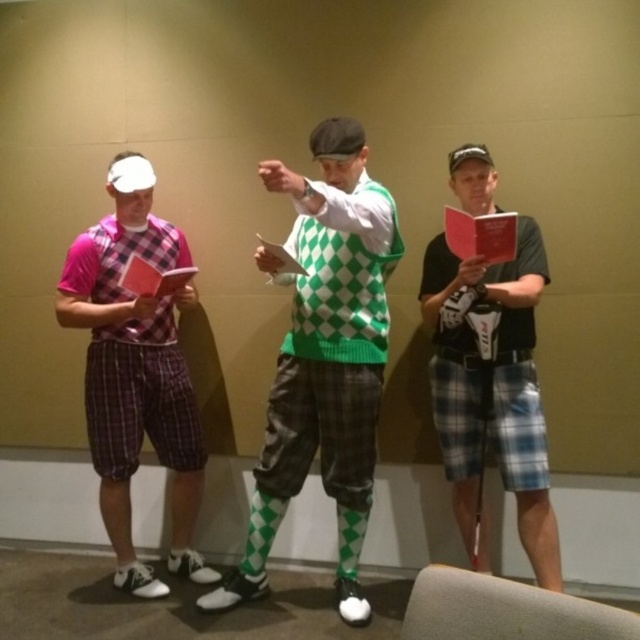
Question: Among these objects, which one is nearest to the camera?

Choices:
 (A) pink plaid shorts at left
 (B) matte red folder at left
 (C) dark gray fabric baseball cap at center

Answer: (C)

Question: Which point is closer to the camera taking this photo?

Choices:
 (A) (353, 134)
 (B) (278, 509)
 (C) (125, 550)
 (D) (378, 384)

Answer: (A)

Question: Is green checkered sweater at center further to camera compared to red matte folder at center?

Choices:
 (A) no
 (B) yes

Answer: (A)

Question: Which of the following is the closest to the observer?

Choices:
 (A) pink plaid shorts at left
 (B) green checkered sweater at center
 (C) green checkered sock at center
 (D) gray plaid shorts at center

Answer: (B)

Question: Is pink plaid shorts at left further to the viewer compared to matte red folder at left?

Choices:
 (A) no
 (B) yes

Answer: (B)

Question: Considering the relative positions of red matte folder at center and matte red folder at left in the image provided, where is red matte folder at center located with respect to matte red folder at left?

Choices:
 (A) right
 (B) left

Answer: (A)